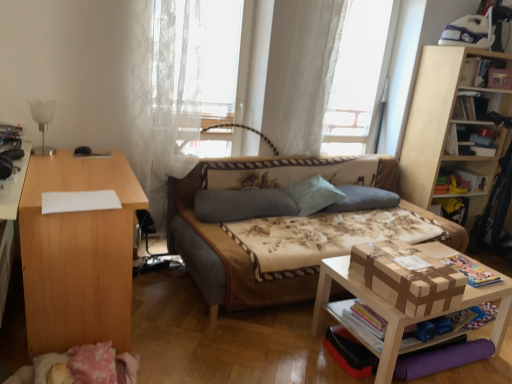
Find the location of a particular element. This screenshot has width=512, height=384. free point to the right of light wood desk at left, the 2th table when ordered from right to left is located at coordinates [x=186, y=333].